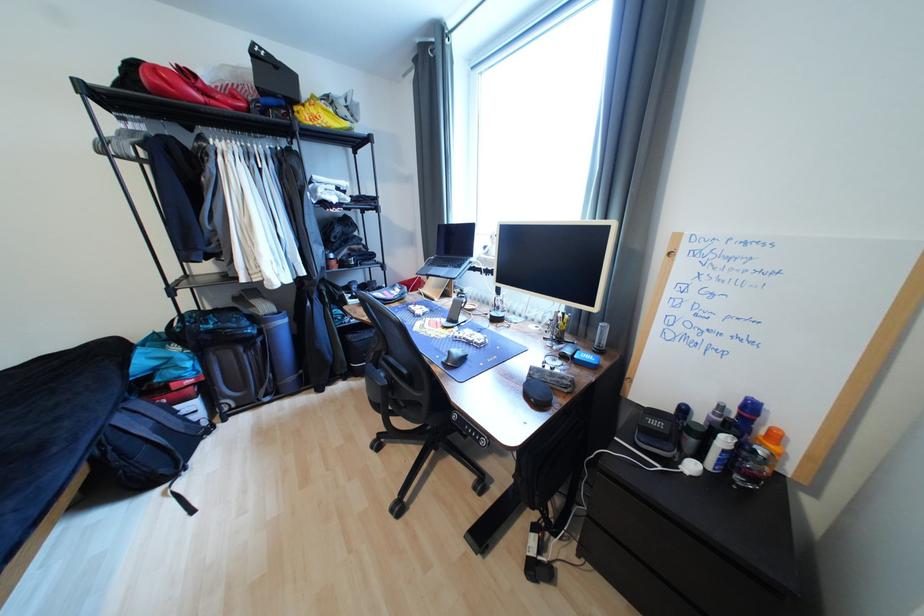
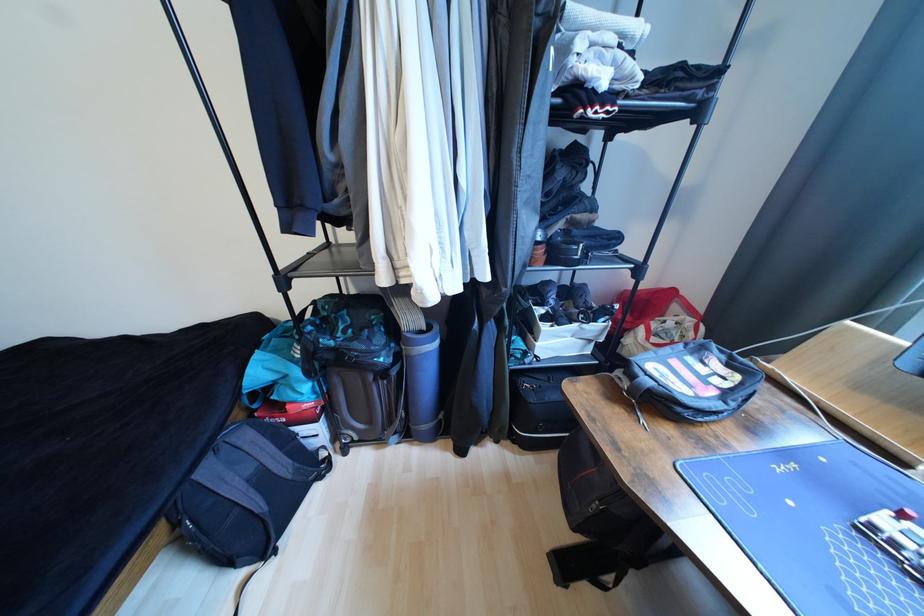
Find the pixel in the second image that matches pixel 128 421 in the first image.

(215, 472)